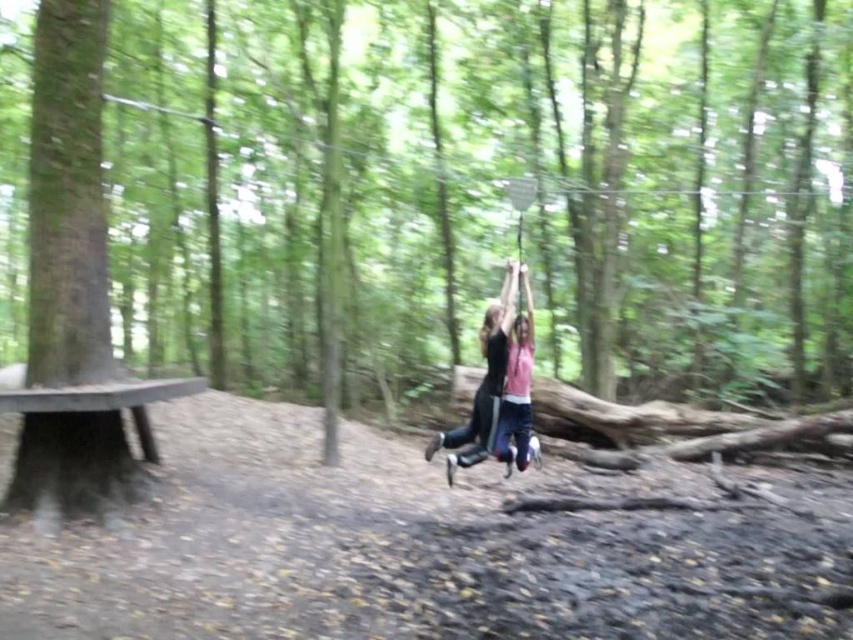
Question: Which point appears closest to the camera in this image?

Choices:
 (A) (511, 298)
 (B) (76, 470)
 (C) (509, 328)

Answer: (B)

Question: Where is dark brown wooden picnic table at lower left located in relation to pink matte shirt at center in the image?

Choices:
 (A) left
 (B) right

Answer: (A)

Question: Is black fabric swing at center thinner than pink matte shirt at center?

Choices:
 (A) yes
 (B) no

Answer: (B)

Question: Is dark brown wooden picnic table at lower left positioned before black fabric swing at center?

Choices:
 (A) no
 (B) yes

Answer: (B)

Question: Which point is closer to the camera?

Choices:
 (A) (132, 394)
 (B) (526, 422)
 (C) (440, 433)

Answer: (A)

Question: Which point is closer to the camera?

Choices:
 (A) black fabric swing at center
 (B) pink matte shirt at center

Answer: (B)